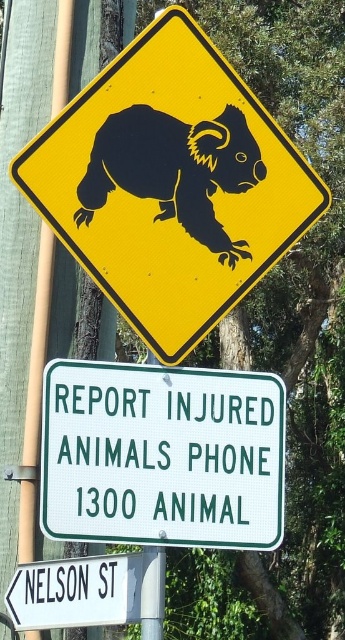
Is point (225, 131) less distant than point (85, 577)?

Yes, point (225, 131) is in front of point (85, 577).

Between black matte koala at center and white plastic street sign at lower left, which one appears on the right side from the viewer's perspective?

Positioned to the right is black matte koala at center.

Measure the distance between point (x=242, y=257) and camera.

Point (x=242, y=257) is 5.37 meters from camera.

In order to click on black matte koala at center in this screenshot , I will do `click(174, 170)`.

Is black plastic koala at upper center bigger than green metal sign at center?

Correct, black plastic koala at upper center is larger in size than green metal sign at center.

Measure the distance between black plastic koala at upper center and green metal sign at center.

The distance of black plastic koala at upper center from green metal sign at center is 19.90 inches.

Identify the location of black plastic koala at upper center. The height and width of the screenshot is (640, 345). (171, 184).

This screenshot has height=640, width=345. What are the coordinates of `black plastic koala at upper center` in the screenshot? It's located at (171, 184).

Is green metal sign at center shorter than black matte koala at center?

In fact, green metal sign at center may be taller than black matte koala at center.

Which is more to the left, green metal sign at center or black matte koala at center?

green metal sign at center is more to the left.

Which is in front, point (72, 454) or point (248, 164)?

Positioned in front is point (72, 454).

You are a GUI agent. You are given a task and a screenshot of the screen. Output one action in this format:
    pyautogui.click(x=<x>, y=<y>)
    Task: Click on the green metal sign at center
    
    Given the screenshot: What is the action you would take?
    pyautogui.click(x=162, y=456)